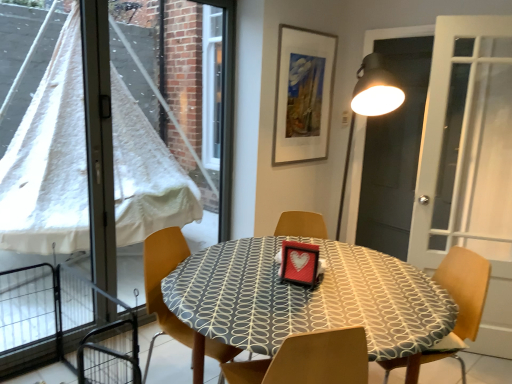
Question: Should I look upward or downward to see patterned fabric table at center?

Choices:
 (A) up
 (B) down

Answer: (B)

Question: Is wooden chair at center, arranged as the 1th chair when viewed from the left, positioned far away from black matte screen door at upper right?

Choices:
 (A) no
 (B) yes

Answer: (B)

Question: Is wooden chair at center, placed as the second chair when sorted from right to left, positioned with its back to black matte screen door at upper right?

Choices:
 (A) yes
 (B) no

Answer: (B)

Question: Is wooden chair at center, placed as the second chair when sorted from right to left, surrounding black matte screen door at upper right?

Choices:
 (A) no
 (B) yes

Answer: (A)

Question: Can you confirm if wooden chair at center, placed as the second chair when sorted from right to left, is bigger than black matte screen door at upper right?

Choices:
 (A) no
 (B) yes

Answer: (B)

Question: Does wooden chair at center, arranged as the 1th chair when viewed from the left, have a smaller size compared to black matte screen door at upper right?

Choices:
 (A) no
 (B) yes

Answer: (A)

Question: Is wooden chair at center, arranged as the 1th chair when viewed from the left, taller than black matte screen door at upper right?

Choices:
 (A) yes
 (B) no

Answer: (B)

Question: From a real-world perspective, is black matte screen door at upper right beneath wooden chair at right, arranged as the 2th chair when viewed from the left?

Choices:
 (A) yes
 (B) no

Answer: (B)

Question: Considering the relative sizes of black matte screen door at upper right and wooden chair at right, arranged as the 2th chair when viewed from the left, in the image provided, is black matte screen door at upper right bigger than wooden chair at right, arranged as the 2th chair when viewed from the left,?

Choices:
 (A) yes
 (B) no

Answer: (B)

Question: Considering the relative sizes of black matte screen door at upper right and wooden chair at right, arranged as the 2th chair when viewed from the left, in the image provided, is black matte screen door at upper right smaller than wooden chair at right, arranged as the 2th chair when viewed from the left,?

Choices:
 (A) yes
 (B) no

Answer: (A)

Question: Considering the relative sizes of black matte screen door at upper right and wooden chair at right, arranged as the 2th chair when viewed from the left, in the image provided, is black matte screen door at upper right thinner than wooden chair at right, arranged as the 2th chair when viewed from the left,?

Choices:
 (A) no
 (B) yes

Answer: (B)

Question: Is black matte screen door at upper right closer to camera compared to wooden chair at right, arranged as the 2th chair when viewed from the left?

Choices:
 (A) no
 (B) yes

Answer: (A)

Question: Does black matte screen door at upper right have a greater height compared to wooden chair at right, arranged as the 2th chair when viewed from the left?

Choices:
 (A) no
 (B) yes

Answer: (B)

Question: Is transparent plastic window at left with black matte screen door at upper right?

Choices:
 (A) yes
 (B) no

Answer: (B)